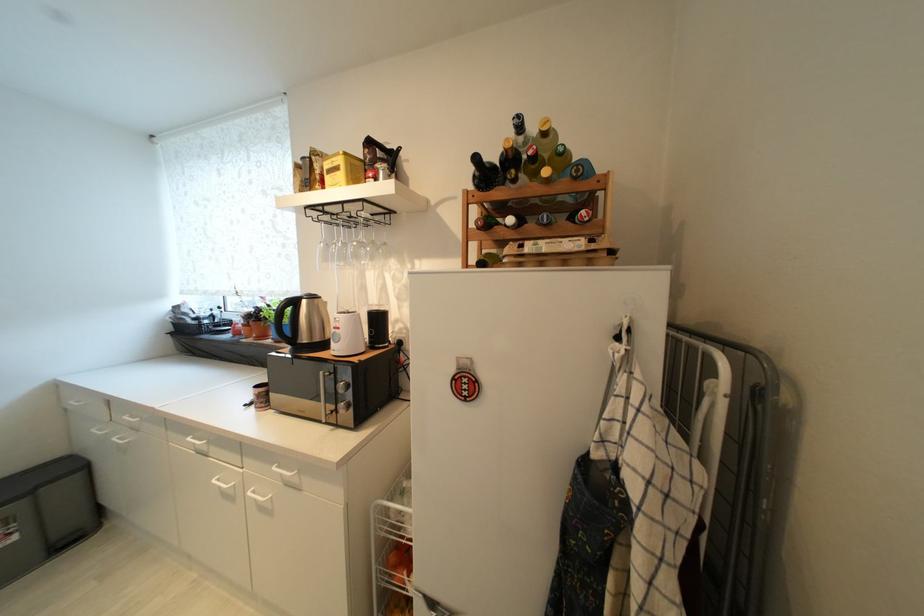
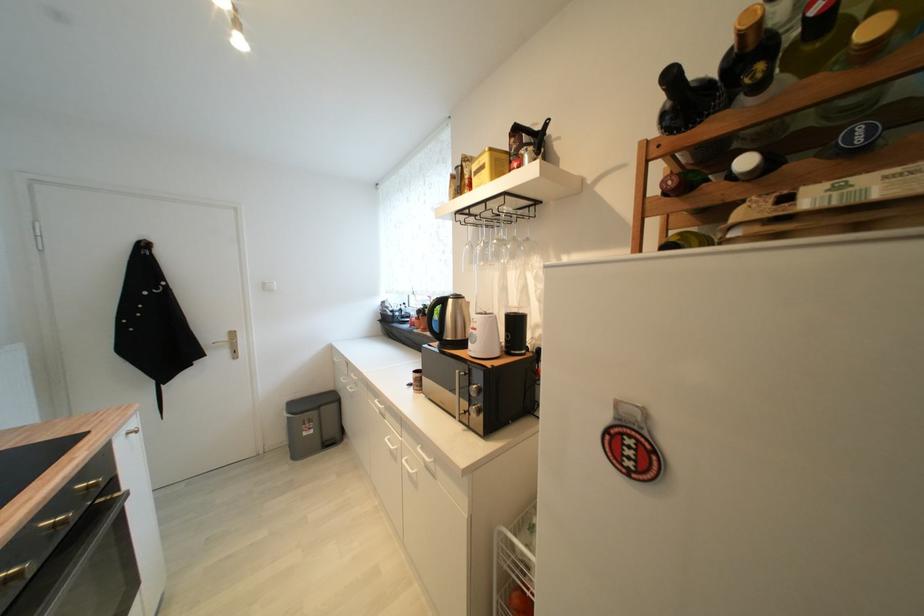
Locate, in the second image, the point that corresponds to the point at 344,330 in the first image.

(480, 331)